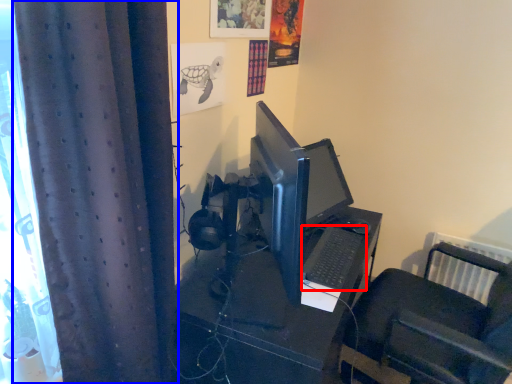
Question: Which of the following is the closest to the observer, computer keyboard (highlighted by a red box) or curtain (highlighted by a blue box)?

Choices:
 (A) computer keyboard
 (B) curtain

Answer: (B)